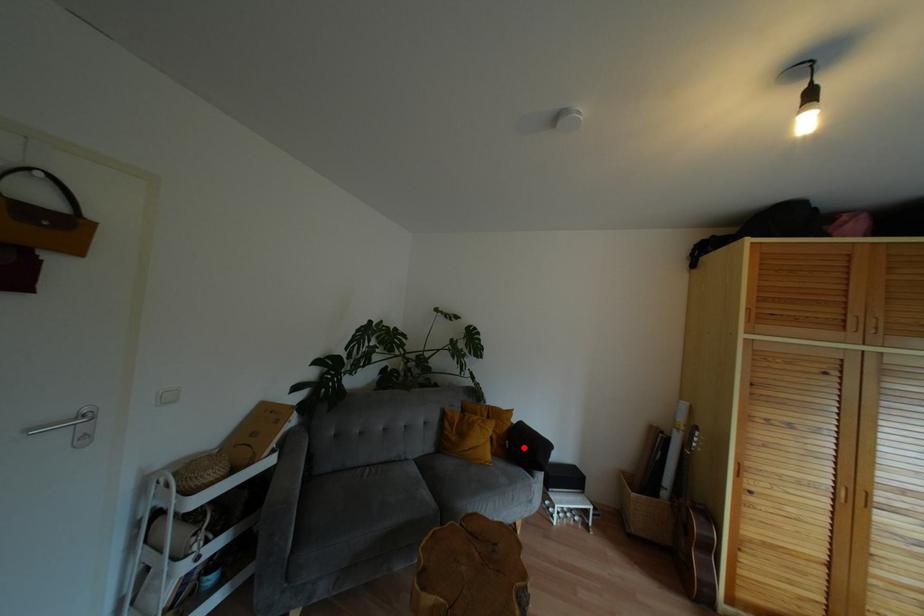
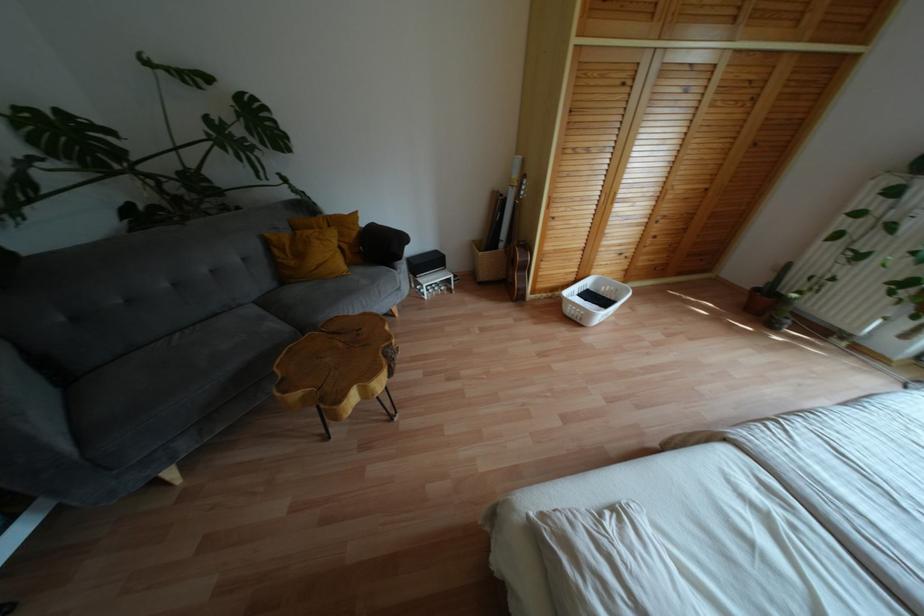
Where in the second image is the point corresponding to the highlighted location from the first image?

(380, 246)